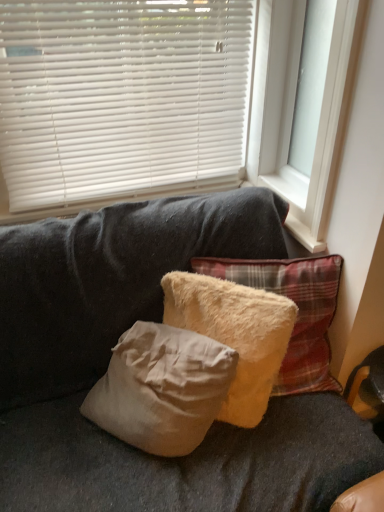
Question: Considering the relative sizes of beige fluffy pillow at center, positioned as the second pillow in right-to-left order, and white plastic window frame at upper right in the image provided, is beige fluffy pillow at center, positioned as the second pillow in right-to-left order, wider than white plastic window frame at upper right?

Choices:
 (A) no
 (B) yes

Answer: (B)

Question: Considering the relative sizes of beige fluffy pillow at center, positioned as the second pillow in right-to-left order, and white plastic window frame at upper right in the image provided, is beige fluffy pillow at center, positioned as the second pillow in right-to-left order, thinner than white plastic window frame at upper right?

Choices:
 (A) no
 (B) yes

Answer: (A)

Question: Can you confirm if beige fluffy pillow at center, positioned as the second pillow in right-to-left order, is smaller than white plastic window frame at upper right?

Choices:
 (A) yes
 (B) no

Answer: (A)

Question: From a real-world perspective, is beige fluffy pillow at center, which ranks as the first pillow in left-to-right order, physically below white plastic window frame at upper right?

Choices:
 (A) yes
 (B) no

Answer: (A)

Question: Is beige fluffy pillow at center, positioned as the second pillow in right-to-left order, to the right of white plastic window frame at upper right from the viewer's perspective?

Choices:
 (A) no
 (B) yes

Answer: (A)

Question: Considering the positions of point (294, 334) and point (175, 183), is point (294, 334) closer or farther from the camera than point (175, 183)?

Choices:
 (A) farther
 (B) closer

Answer: (B)

Question: From the image's perspective, is fuzzy beige pillow at center, the second pillow in the left-to-right sequence, positioned above or below white plastic blinds at upper center?

Choices:
 (A) above
 (B) below

Answer: (B)

Question: Is fuzzy beige pillow at center, the second pillow in the left-to-right sequence, situated inside white plastic blinds at upper center or outside?

Choices:
 (A) inside
 (B) outside

Answer: (B)

Question: Considering their positions, is fuzzy beige pillow at center, which is the 1th pillow from right to left, located in front of or behind white plastic blinds at upper center?

Choices:
 (A) behind
 (B) front

Answer: (B)

Question: Is white plastic blinds at upper center to the left or to the right of fuzzy beige pillow at center, which is the 1th pillow from right to left, in the image?

Choices:
 (A) left
 (B) right

Answer: (A)

Question: From a real-world perspective, is white plastic blinds at upper center physically located above or below fuzzy beige pillow at center, the second pillow in the left-to-right sequence?

Choices:
 (A) above
 (B) below

Answer: (A)

Question: From the image's perspective, relative to fuzzy beige pillow at center, the second pillow in the left-to-right sequence, is white plastic blinds at upper center above or below?

Choices:
 (A) below
 (B) above

Answer: (B)

Question: In terms of height, does white plastic blinds at upper center look taller or shorter compared to fuzzy beige pillow at center, which is the 1th pillow from right to left?

Choices:
 (A) tall
 (B) short

Answer: (A)

Question: Considering the relative positions of white plastic window frame at upper right and fuzzy beige pillow at center, which is the 1th pillow from right to left, in the image provided, is white plastic window frame at upper right to the left or to the right of fuzzy beige pillow at center, which is the 1th pillow from right to left,?

Choices:
 (A) left
 (B) right

Answer: (B)

Question: From the image's perspective, is white plastic window frame at upper right located above or below fuzzy beige pillow at center, which is the 1th pillow from right to left?

Choices:
 (A) below
 (B) above

Answer: (B)